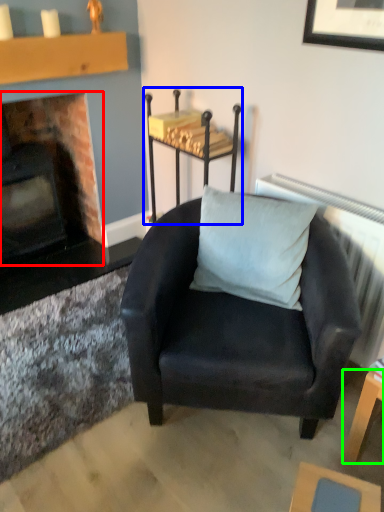
Question: Which object is the farthest from fireplace (highlighted by a red box)? Choose among these: table (highlighted by a blue box) or table (highlighted by a green box).

Choices:
 (A) table
 (B) table

Answer: (B)